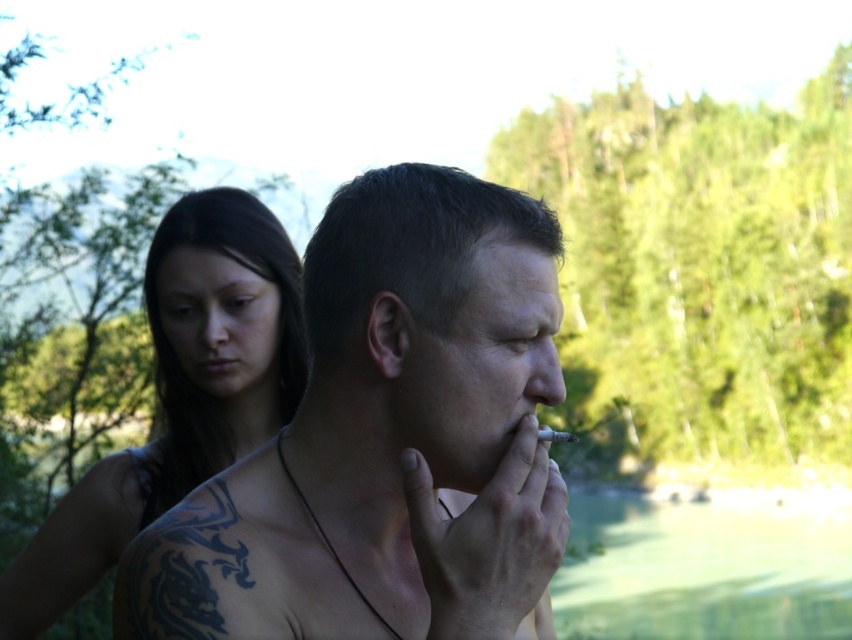
How far apart are shiny metallic cigarette at center and green liquid water at lower right?

A distance of 3.41 meters exists between shiny metallic cigarette at center and green liquid water at lower right.

Which is more to the right, shiny metallic cigarette at center or green liquid water at lower right?

Positioned to the right is green liquid water at lower right.

Does point (196, 566) lie in front of point (804, 600)?

Yes, point (196, 566) is closer to viewer.

Image resolution: width=852 pixels, height=640 pixels. Identify the location of shiny metallic cigarette at center. (386, 436).

Between black tattooed skin at upper left and green liquid water at lower right, which one appears on the right side from the viewer's perspective?

Positioned to the right is green liquid water at lower right.

Who is more distant from viewer, (x=255, y=278) or (x=563, y=600)?

Point (x=563, y=600)

The image size is (852, 640). In order to click on black tattooed skin at upper left in this screenshot , I will do `click(179, 394)`.

Can you confirm if green liquid water at lower right is wider than gray matte cigarette at mouth?

Yes, green liquid water at lower right is wider than gray matte cigarette at mouth.

Does point (787, 625) come farther from viewer compared to point (548, 435)?

Yes, it is behind point (548, 435).

Where is `green liquid water at lower right`? green liquid water at lower right is located at coordinates (701, 570).